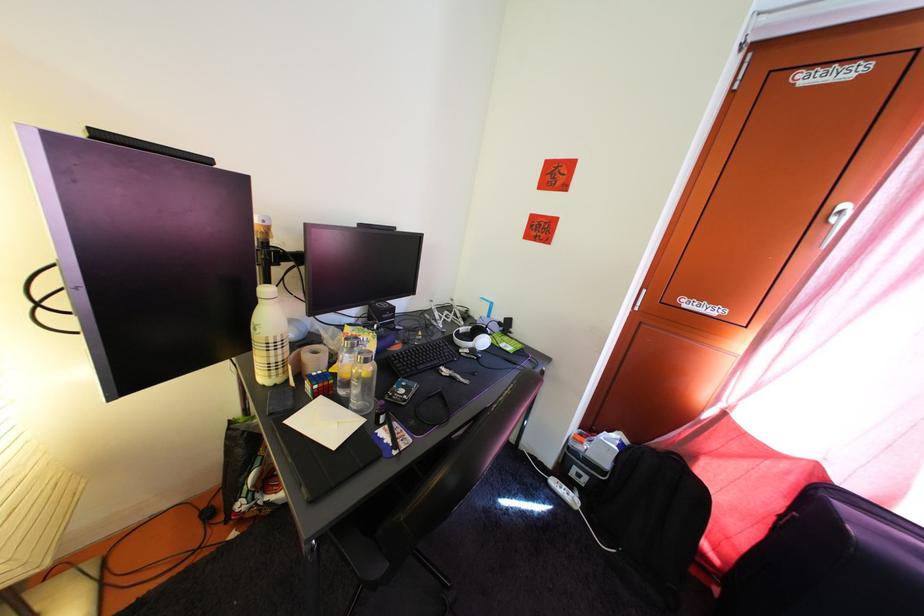
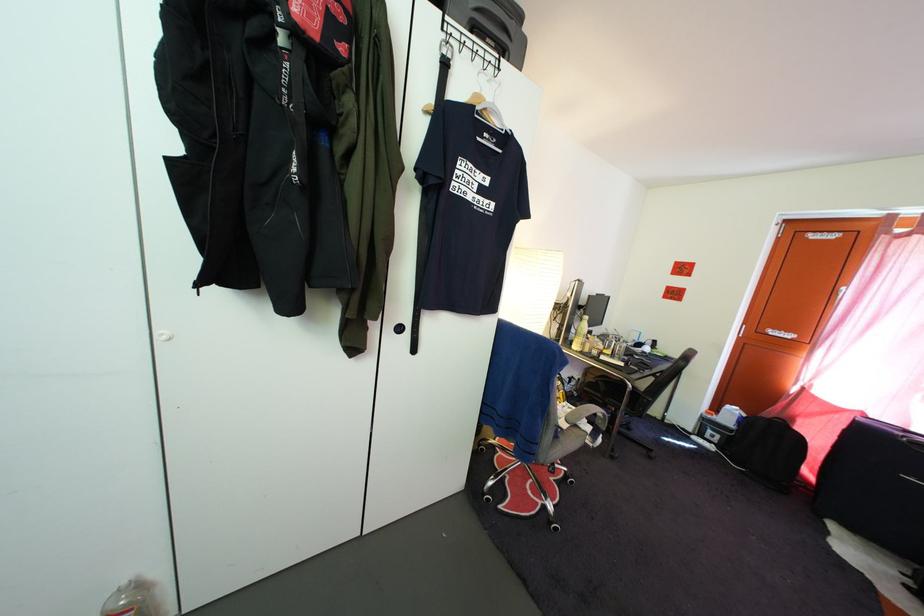
The point at [588,484] is marked in the first image. Where is the corresponding point in the second image?

(721, 445)